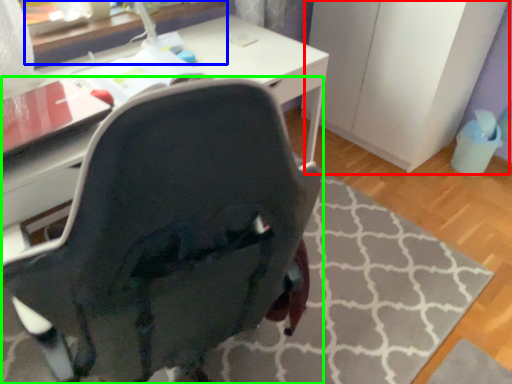
Question: Which is farther away from file cabinet (highlighted by a red box)? table (highlighted by a blue box) or chair (highlighted by a green box)?

Choices:
 (A) table
 (B) chair

Answer: (B)